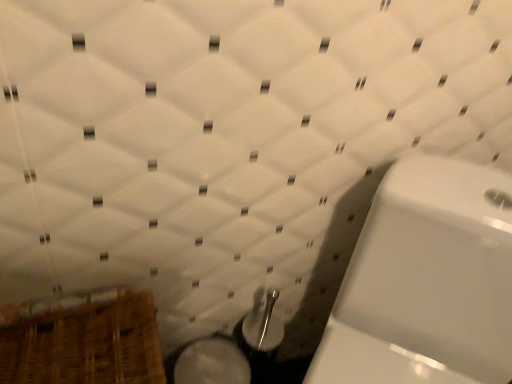
Question: Is white glossy toilet at right turned away from wooden basket at lower left?

Choices:
 (A) yes
 (B) no

Answer: (B)

Question: Is white glossy toilet at right taller than wooden basket at lower left?

Choices:
 (A) no
 (B) yes

Answer: (B)

Question: From the image's perspective, is white glossy toilet at right on top of wooden basket at lower left?

Choices:
 (A) no
 (B) yes

Answer: (B)

Question: Considering the relative sizes of white glossy toilet at right and wooden basket at lower left in the image provided, is white glossy toilet at right wider than wooden basket at lower left?

Choices:
 (A) no
 (B) yes

Answer: (B)

Question: From a real-world perspective, is white glossy toilet at right physically below wooden basket at lower left?

Choices:
 (A) no
 (B) yes

Answer: (A)

Question: Visually, is white glossy toilet at right positioned to the left or to the right of wooden basket at lower left?

Choices:
 (A) left
 (B) right

Answer: (B)

Question: From the image's perspective, is white glossy toilet at right above or below wooden basket at lower left?

Choices:
 (A) below
 (B) above

Answer: (B)

Question: Relative to wooden basket at lower left, is white glossy toilet at right in front or behind?

Choices:
 (A) behind
 (B) front

Answer: (B)

Question: Does point (329, 354) appear closer or farther from the camera than point (154, 309)?

Choices:
 (A) closer
 (B) farther

Answer: (B)

Question: Visually, is white glossy bidet at lower center positioned to the left or to the right of wooden basket at lower left?

Choices:
 (A) right
 (B) left

Answer: (A)

Question: In the image, is white glossy bidet at lower center positioned in front of or behind wooden basket at lower left?

Choices:
 (A) behind
 (B) front

Answer: (A)

Question: Considering the positions of white glossy bidet at lower center and wooden basket at lower left in the image, is white glossy bidet at lower center bigger or smaller than wooden basket at lower left?

Choices:
 (A) small
 (B) big

Answer: (A)

Question: Is point (215, 337) positioned closer to the camera than point (22, 372)?

Choices:
 (A) farther
 (B) closer

Answer: (A)

Question: Looking at the image, does white glossy bidet at lower center seem bigger or smaller compared to white glossy toilet at right?

Choices:
 (A) small
 (B) big

Answer: (A)

Question: Is white glossy bidet at lower center wider or thinner than white glossy toilet at right?

Choices:
 (A) thin
 (B) wide

Answer: (A)